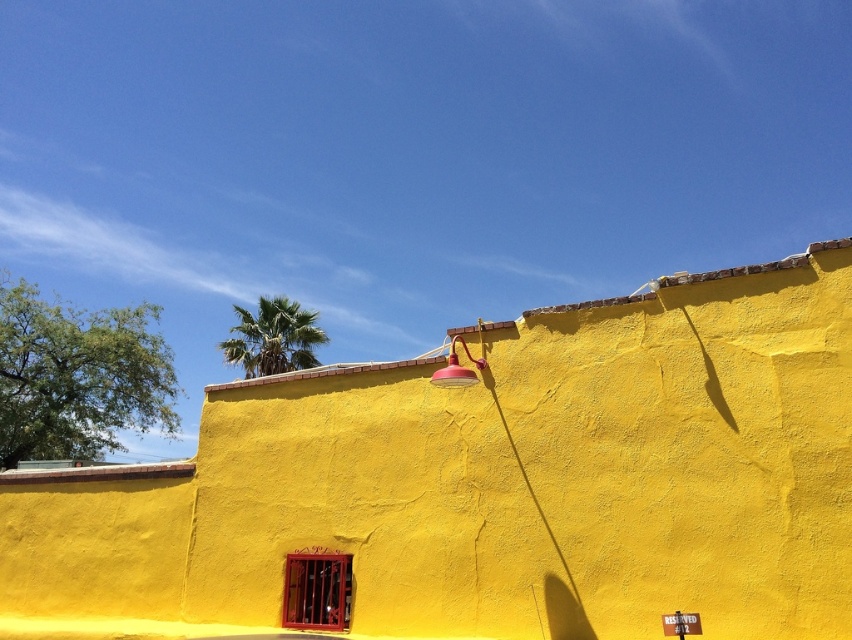
You are standing in front of the yellow wall and want to touch both points on the wall. Which point should you reach for first, the point at coordinate [308,364] or the point at coordinate [453,355]?

You should reach for the point at coordinate [308,364] first because it is closer to you than the point at coordinate [453,355].

You are standing in front of the yellow wall and notice both the green leafy palm tree at upper center and the matte red lamp at upper center. Which object appears taller in the image?

The green leafy palm tree at upper center is much taller than the matte red lamp at upper center, so it appears taller in the image.

You are standing in front of the yellow wall and notice a green leafy palm tree at upper center and a matte red lamp at upper center. Which object is closer to the left edge of the wall?

The green leafy palm tree at upper center is positioned on the left side of the matte red lamp at upper center, so it is closer to the left edge of the wall.